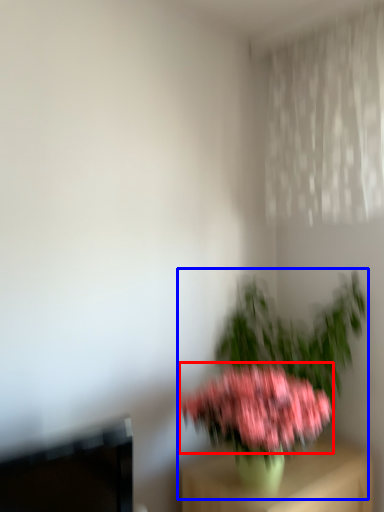
Question: Which of the following is the farthest to the observer, flower (highlighted by a red box) or houseplant (highlighted by a blue box)?

Choices:
 (A) flower
 (B) houseplant

Answer: (B)